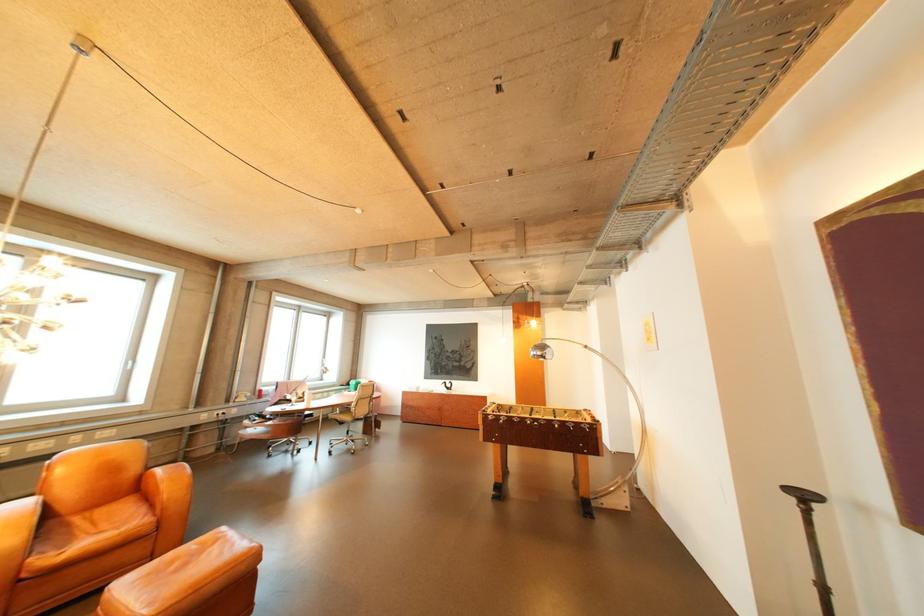
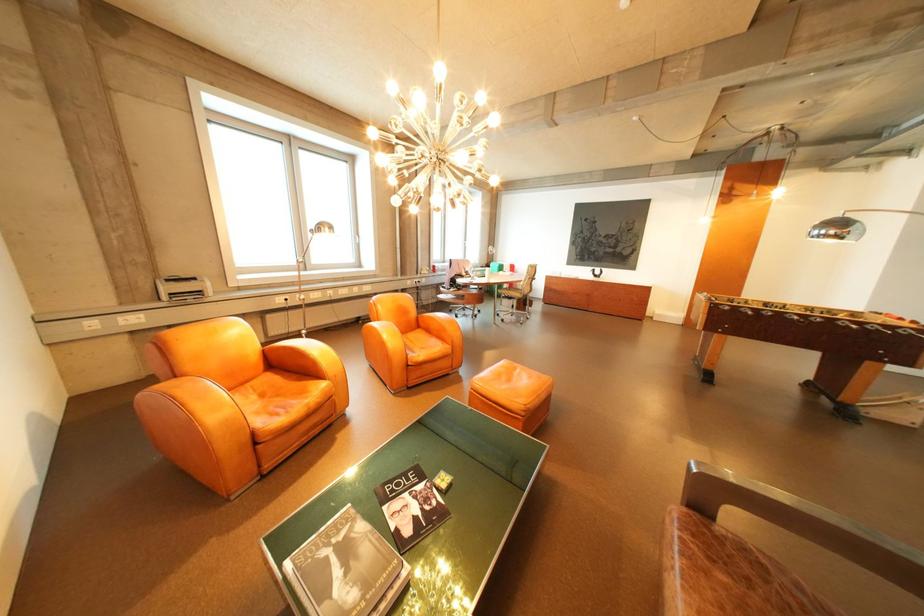
In the second image, find the point that corresponds to [552,354] in the first image.

(846, 233)